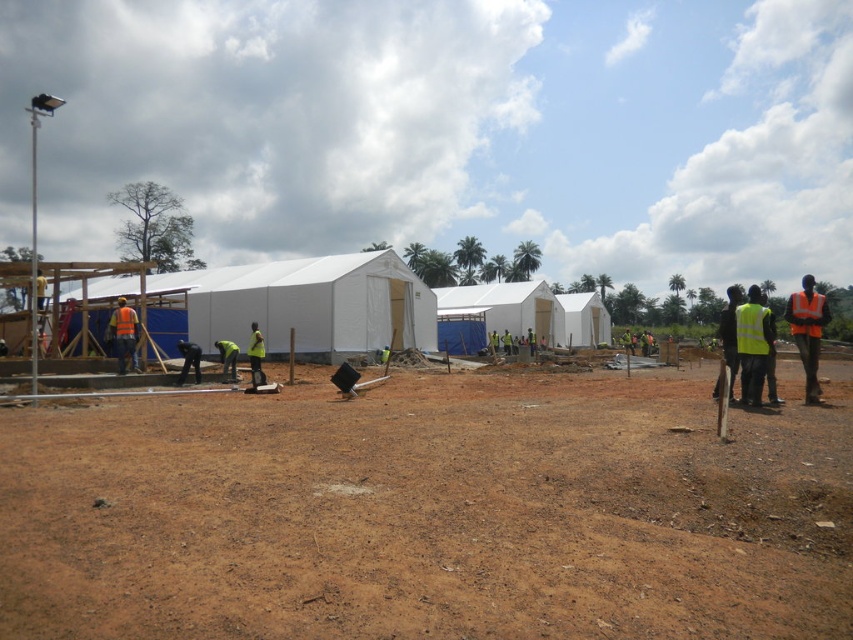
Based on the photo, you are a safety inspector at the construction site. You notice two safety vests at the right side of the image. Which one is taller, the high visibility yellow vest at right or the high visibility fabric safety vest at right?

The high visibility yellow vest at right is taller than the high visibility fabric safety vest at right.

You are an inspector standing at the center of the construction site. You need to locate the high visibility yellow vest at right. According to the coordinates provided, where should you look relative to your position?

The high visibility yellow vest at right is located at coordinates point (807, 332), which corresponds to the right side and lower part of the scene from your central position.

You are standing at the construction site and want to know which of the two points, point (741, 326) or point (119, 314), is closer to you. Can you determine this based on the scene?

Point (741, 326) is closer to the viewer than point (119, 314).